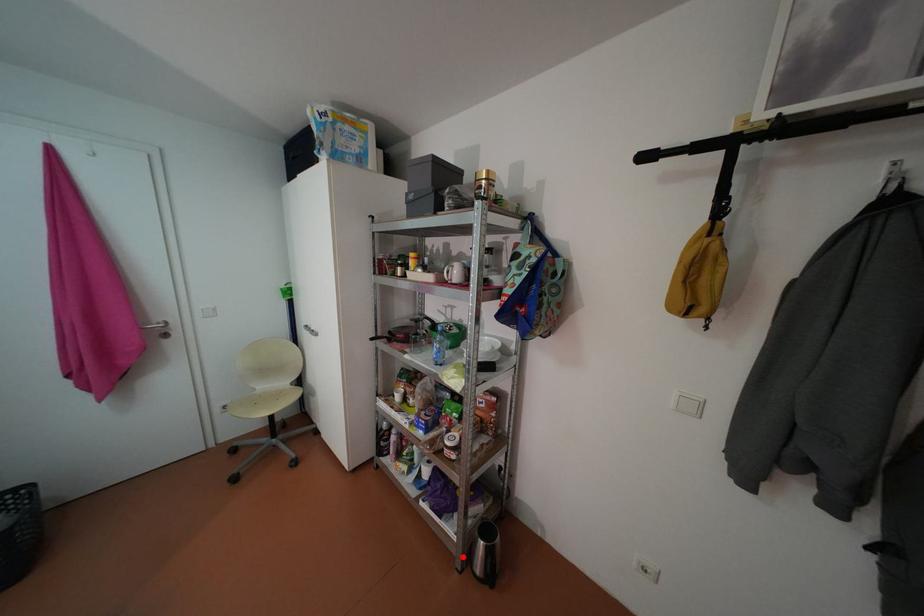
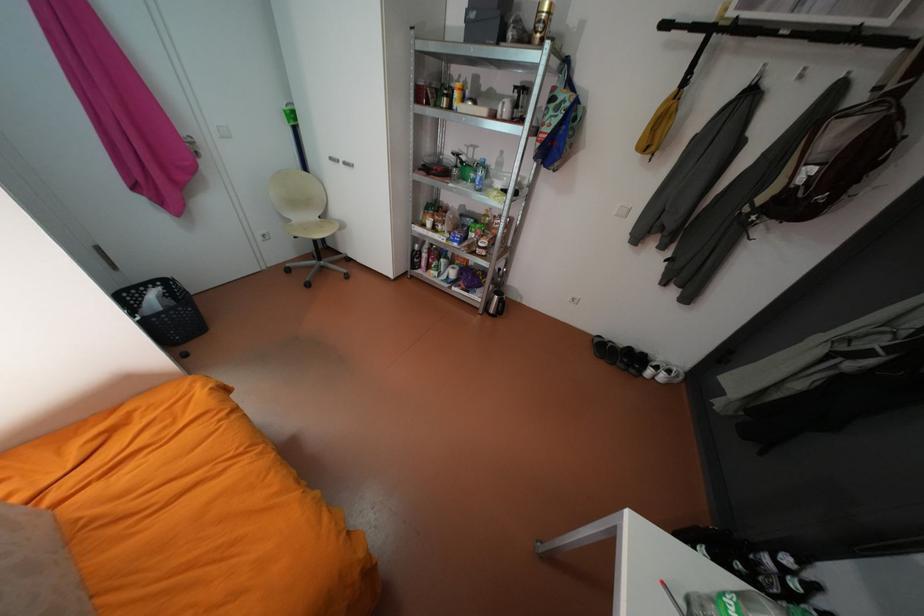
Question: I am providing you with two images of the same scene from different viewpoints. A red point is marked on the first image. Is the red point's position out of view in image 2?

Choices:
 (A) Yes
 (B) No

Answer: (B)